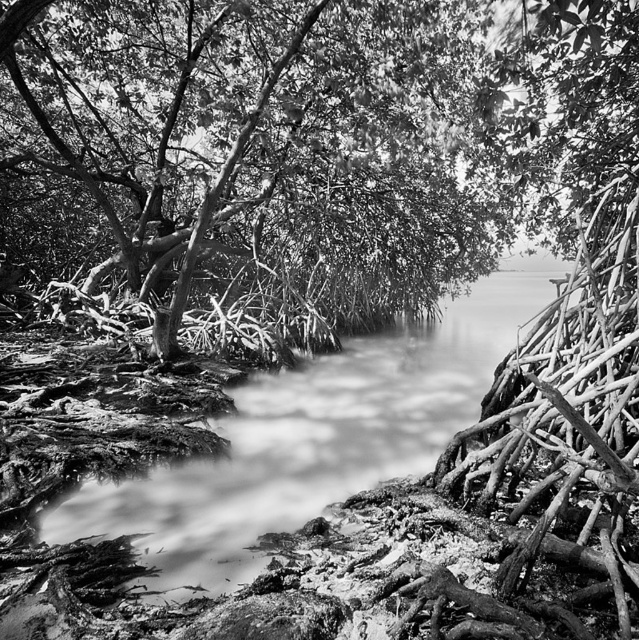
You are standing in the mangrove forest and want to place a small marker at both point (x=520, y=182) and point (x=325, y=435). Which point is closer to you?

Point (x=520, y=182) is closer to you because it is further to the viewer than point (x=325, y=435).

You are a researcher studying mangrove ecosystems. Your task is to locate the smooth bark tree at center in this image. Based on the coordinates provided, where exactly would you find it?

The smooth bark tree at center is located at coordinates point [323,140].

You are a photographer wanting to capture the smooth bark tree at center and the smooth mud stream at center in a single frame. Based on their positions, can you determine which one will appear closer to the camera in the photo?

The smooth bark tree at center is located above the smooth mud stream at center, so in the photo, the smooth bark tree at center will appear closer to the camera than the smooth mud stream at center because it is positioned higher in the frame.